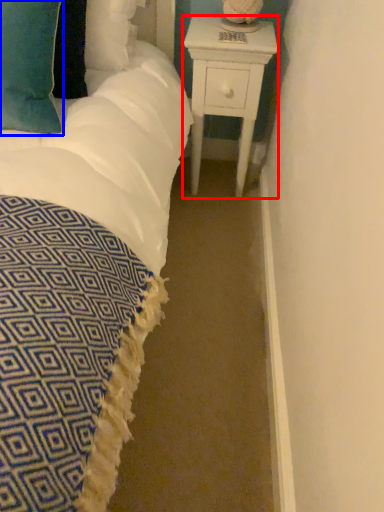
Question: Which point is closer to the camera, nightstand (highlighted by a red box) or pillow (highlighted by a blue box)?

Choices:
 (A) nightstand
 (B) pillow

Answer: (B)